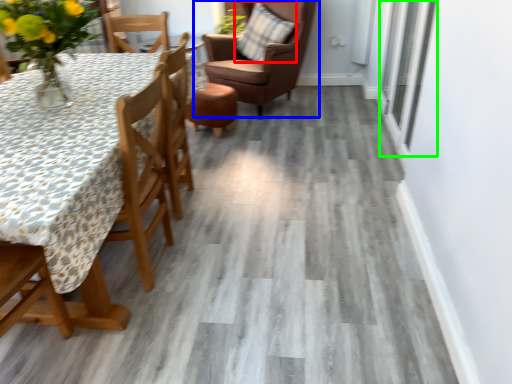
Question: Estimate the real-world distances between objects in this image. Which object is farther from pillow (highlighted by a red box), chair (highlighted by a blue box) or window (highlighted by a green box)?

Choices:
 (A) chair
 (B) window

Answer: (B)